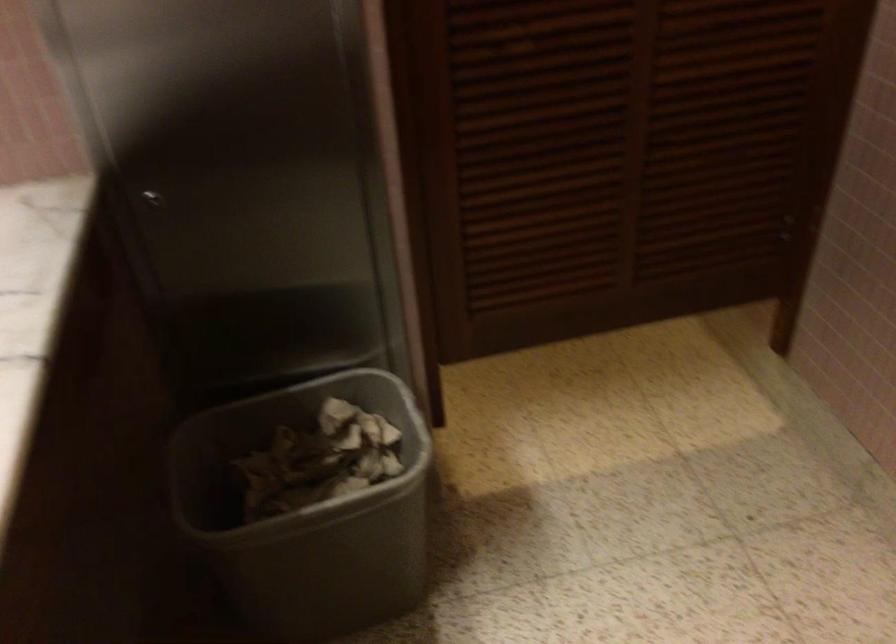
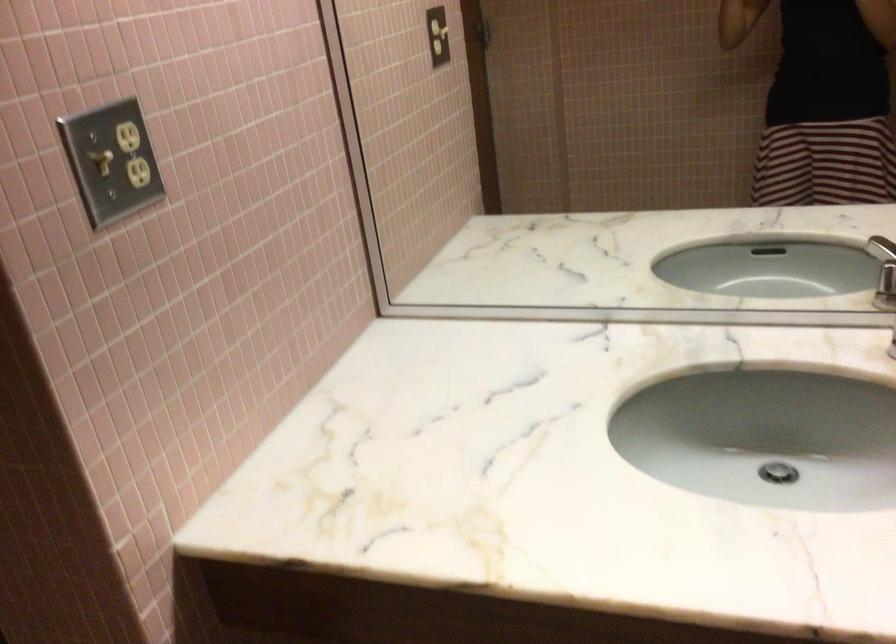
The images are taken continuously from a first-person perspective. In which direction is your viewpoint rotating?

The rotation direction of the camera is left-down.